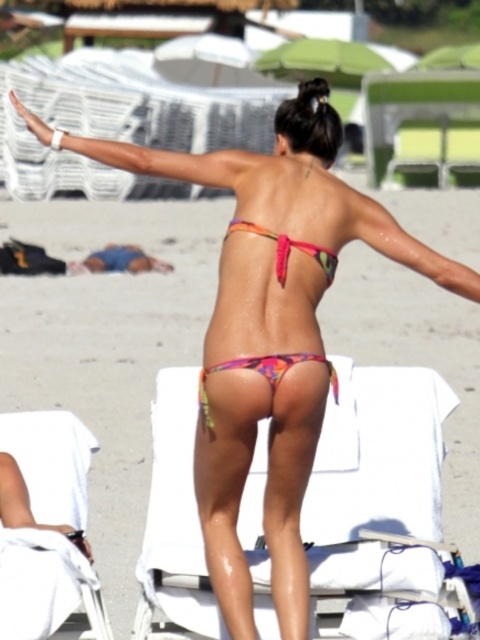
Can you confirm if matte white arm at upper left is positioned below multicolored fabric bikini top at center?

Incorrect, matte white arm at upper left is not positioned below multicolored fabric bikini top at center.

Between matte white arm at upper left and multicolored fabric bikini top at center, which one is positioned higher?

matte white arm at upper left is higher up.

Identify the location of matte white arm at upper left. (164, 161).

Locate an element on the screen. The height and width of the screenshot is (640, 480). pink matte bikini top at upper center is located at coordinates (405, 244).

This screenshot has height=640, width=480. I want to click on pink matte bikini top at upper center, so click(x=405, y=244).

Locate an element on the screen. This screenshot has width=480, height=640. pink matte bikini top at upper center is located at coordinates (405, 244).

Who is taller, pink matte bikini top at upper center or multicolored fabric bikini top at center?

Standing taller between the two is pink matte bikini top at upper center.

Can you confirm if pink matte bikini top at upper center is positioned above multicolored fabric bikini top at center?

Indeed, pink matte bikini top at upper center is positioned over multicolored fabric bikini top at center.

Looking at this image, who is more forward, (432, 257) or (250, 221)?

Point (250, 221) is in front.

This screenshot has width=480, height=640. What are the coordinates of `pink matte bikini top at upper center` in the screenshot? It's located at pos(405,244).